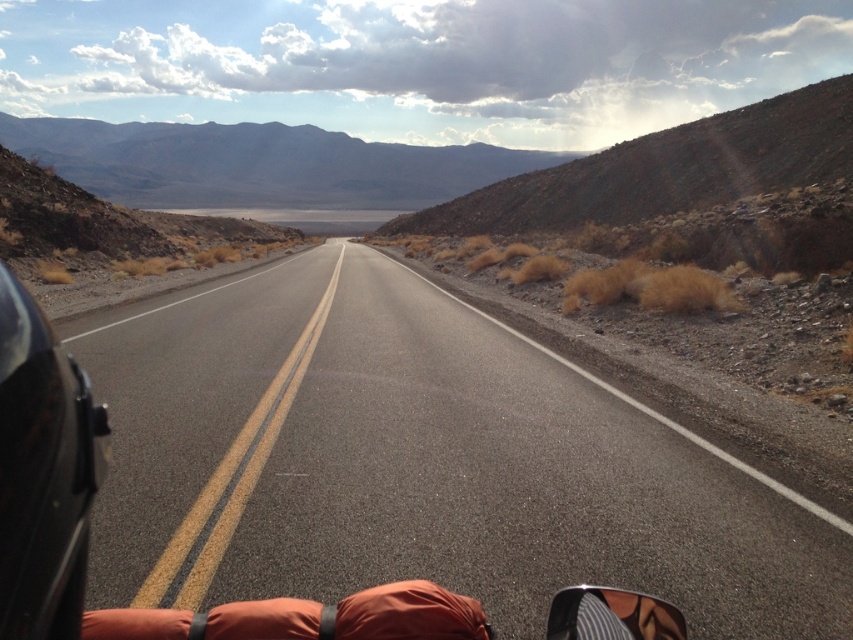
Can you confirm if black asphalt road at center is taller than orange fabric sleeping bag at lower center?

Yes, black asphalt road at center is taller than orange fabric sleeping bag at lower center.

Between point (148, 314) and point (416, 589), which one is positioned behind?

The point (148, 314) is more distant.

I want to click on black asphalt road at center, so click(x=421, y=464).

Locate an element on the screen. The width and height of the screenshot is (853, 640). black asphalt road at center is located at coordinates (421, 464).

Between black glossy motorcycle at left and orange fabric sleeping bag at lower center, which one is positioned lower?

orange fabric sleeping bag at lower center

Who is more distant from viewer, (32, 412) or (358, 608)?

The point (358, 608) is more distant.

This screenshot has width=853, height=640. What are the coordinates of `black glossy motorcycle at left` in the screenshot? It's located at (44, 472).

Which is more to the left, black asphalt road at center or black glossy motorcycle at left?

black glossy motorcycle at left is more to the left.

Is black asphalt road at center to the right of black glossy motorcycle at left from the viewer's perspective?

Yes, black asphalt road at center is to the right of black glossy motorcycle at left.

Does point (401, 298) come behind point (71, 584)?

That is True.

What are the coordinates of `black asphalt road at center` in the screenshot? It's located at (421, 464).